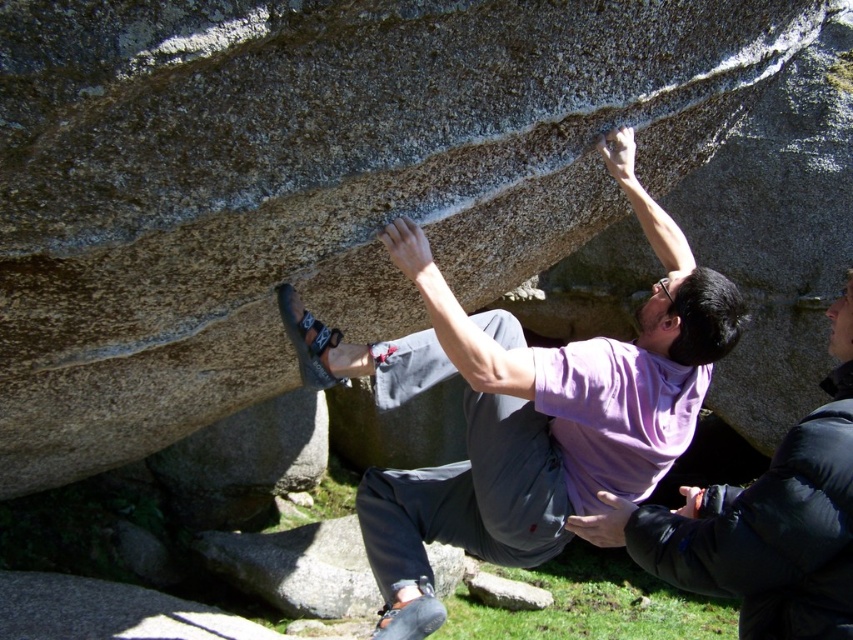
Question: Is purple cotton shirt at center bigger than purple matte shirt at upper center?

Choices:
 (A) yes
 (B) no

Answer: (A)

Question: Which point appears farthest from the camera in this image?

Choices:
 (A) (486, 579)
 (B) (624, 545)

Answer: (A)

Question: Does purple cotton shirt at center have a larger size compared to gray rough rock at lower center?

Choices:
 (A) no
 (B) yes

Answer: (B)

Question: Observing the image, what is the correct spatial positioning of purple cotton shirt at center in reference to purple matte shirt at upper center?

Choices:
 (A) below
 (B) above

Answer: (B)

Question: Based on their relative distances, which object is farther from the gray rough rock at lower center?

Choices:
 (A) purple cotton shirt at center
 (B) purple matte shirt at upper center

Answer: (B)

Question: Which is nearer to the gray rough rock at lower center?

Choices:
 (A) purple cotton shirt at center
 (B) purple matte shirt at upper center

Answer: (A)